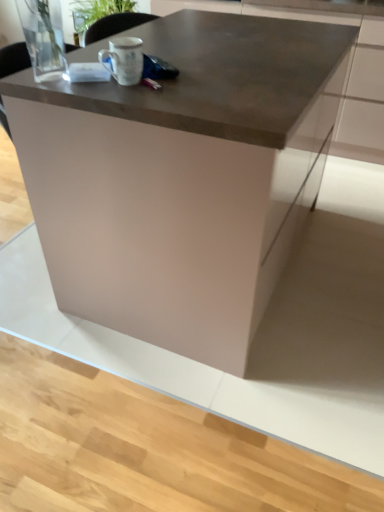
Question: Can you confirm if white matte mug at upper center is taller than matte brown table at center?

Choices:
 (A) no
 (B) yes

Answer: (A)

Question: Does white matte mug at upper center have a smaller size compared to matte brown table at center?

Choices:
 (A) yes
 (B) no

Answer: (A)

Question: Considering the relative sizes of white matte mug at upper center and matte brown table at center in the image provided, is white matte mug at upper center thinner than matte brown table at center?

Choices:
 (A) yes
 (B) no

Answer: (A)

Question: Would you consider white matte mug at upper center to be distant from matte brown table at center?

Choices:
 (A) yes
 (B) no

Answer: (B)

Question: From the image's perspective, does white matte mug at upper center appear higher than matte brown table at center?

Choices:
 (A) yes
 (B) no

Answer: (A)

Question: Would you say white matte mug at upper center is to the left or to the right of satin metallic countertop at upper center in the picture?

Choices:
 (A) right
 (B) left

Answer: (B)

Question: Relative to satin metallic countertop at upper center, is white matte mug at upper center in front or behind?

Choices:
 (A) front
 (B) behind

Answer: (A)

Question: From a real-world perspective, relative to satin metallic countertop at upper center, is white matte mug at upper center vertically above or below?

Choices:
 (A) above
 (B) below

Answer: (A)

Question: Is white matte mug at upper center situated inside satin metallic countertop at upper center or outside?

Choices:
 (A) inside
 (B) outside

Answer: (B)

Question: Do you think matte brown table at center is within satin metallic countertop at upper center, or outside of it?

Choices:
 (A) outside
 (B) inside

Answer: (A)

Question: In terms of height, does matte brown table at center look taller or shorter compared to satin metallic countertop at upper center?

Choices:
 (A) tall
 (B) short

Answer: (A)

Question: Considering the positions of point (258, 132) and point (365, 35), is point (258, 132) closer or farther from the camera than point (365, 35)?

Choices:
 (A) farther
 (B) closer

Answer: (B)

Question: From a real-world perspective, is matte brown table at center physically located above or below satin metallic countertop at upper center?

Choices:
 (A) below
 (B) above

Answer: (A)

Question: Is satin metallic countertop at upper center situated inside matte brown table at center or outside?

Choices:
 (A) inside
 (B) outside

Answer: (B)

Question: Visually, is satin metallic countertop at upper center positioned to the left or to the right of matte brown table at center?

Choices:
 (A) left
 (B) right

Answer: (B)